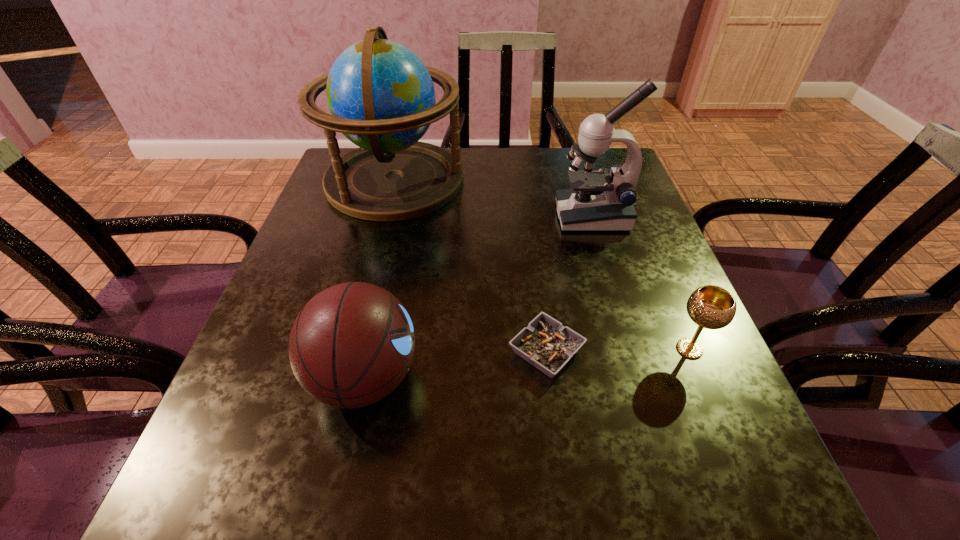
Find the location of a particular element. Image resolution: width=960 pixels, height=540 pixels. the fourth closest object to the second shortest object is located at coordinates (381, 97).

Locate which object is the fourth closest to the globe. Please provide its 2D coordinates. Your answer should be formatted as a tuple, i.e. [(x, y)], where the tuple contains the x and y coordinates of a point satisfying the conditions above.

[(712, 307)]

The image size is (960, 540). I want to click on vacant region that satisfies the following two spatial constraints: 1. on the back side of the shortest object; 2. on the left side of the fourth tallest object, so click(546, 349).

At what (x,y) coordinates should I click in order to perform the action: click on vacant space that satisfies the following two spatial constraints: 1. on the front side of the microscope; 2. on the left side of the fourth tallest object. Please return your answer as a coordinate pair (x, y). Image resolution: width=960 pixels, height=540 pixels. Looking at the image, I should click on (634, 349).

Identify the location of free location that satisfies the following two spatial constraints: 1. on the front side of the third tallest object; 2. on the left side of the globe. This screenshot has height=540, width=960. (344, 378).

Where is `free location that satisfies the following two spatial constraints: 1. on the front side of the third tallest object; 2. on the left side of the globe`? The height and width of the screenshot is (540, 960). free location that satisfies the following two spatial constraints: 1. on the front side of the third tallest object; 2. on the left side of the globe is located at coordinates (344, 378).

Locate an element on the screen. vacant space that satisfies the following two spatial constraints: 1. on the front side of the second shortest object; 2. on the left side of the globe is located at coordinates click(351, 349).